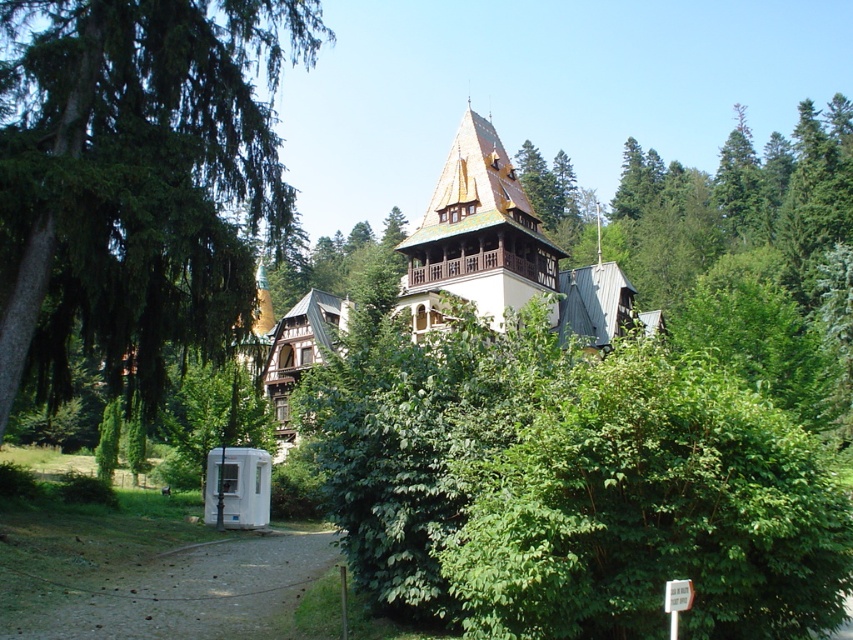
You are standing at point (134,176) in the scene. What object is located exactly at your current position?

At point (134,176) lies green leafy tree at left.

You are standing at the center of the image. Which direction should you look to see the green leafy tree at left?

The green leafy tree at left is located at point (134, 176), which is to the left side of the image. Therefore, you should look to your left to see it.

You are a bird looking for a nesting spot. You see the green leafy tree at left and the brown tiled roof at center. Which location would be higher for nesting?

The green leafy tree at left is taller than the brown tiled roof at center, so the green leafy tree at left would be a higher nesting spot.